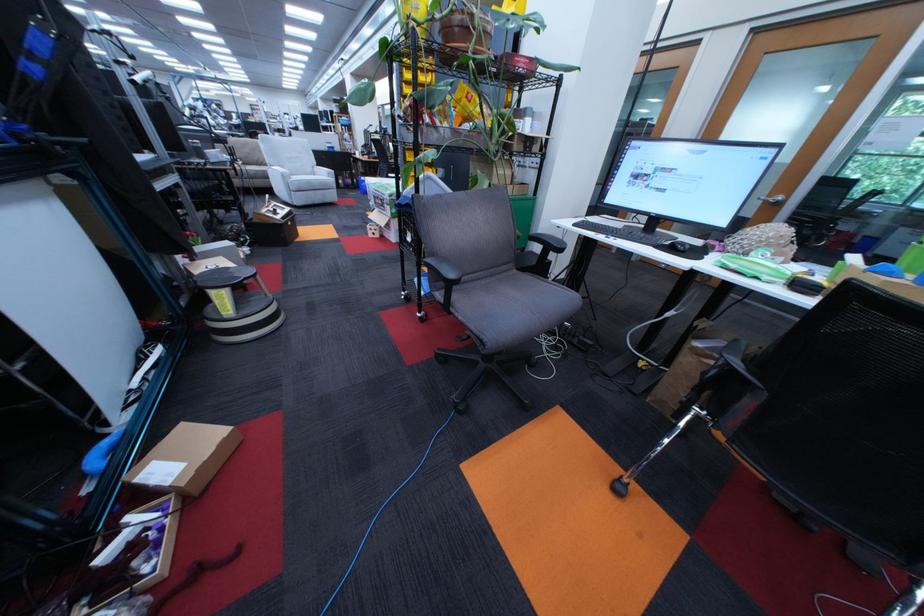
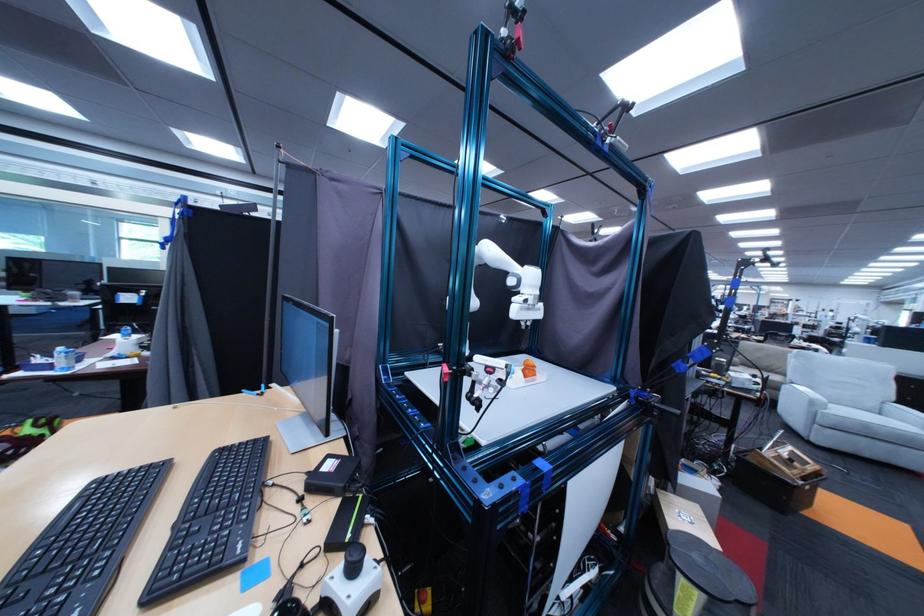
Locate, in the second image, the point that corresponds to [322,183] in the first image.

(879, 426)